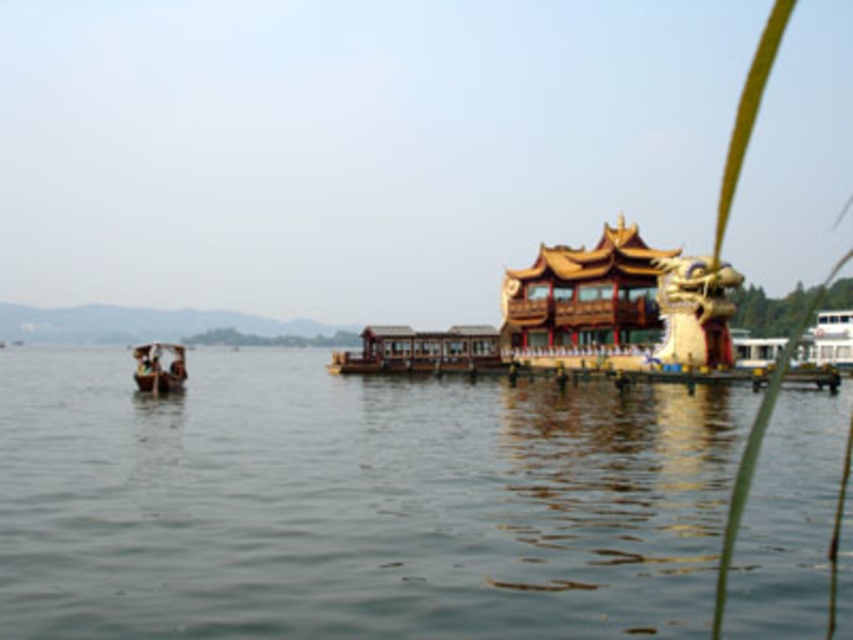
Looking at this image, is the position of transparent water at center less distant than that of wooden boat at left?

Yes.

Is transparent water at center positioned at the back of wooden boat at left?

That is False.

You are a GUI agent. You are given a task and a screenshot of the screen. Output one action in this format:
    pyautogui.click(x=<x>, y=<y>)
    Task: Click on the transparent water at center
    This screenshot has width=853, height=640.
    Given the screenshot: What is the action you would take?
    pyautogui.click(x=355, y=502)